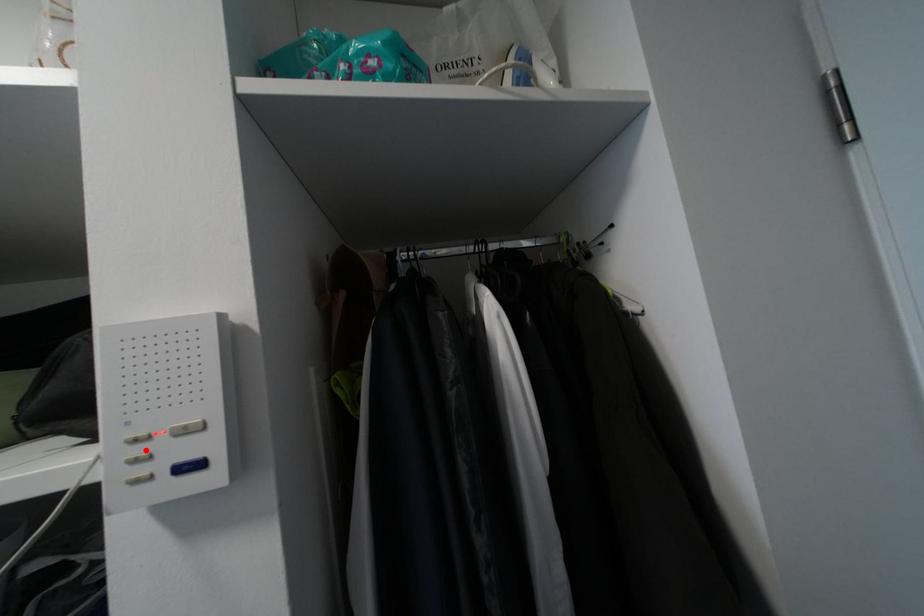
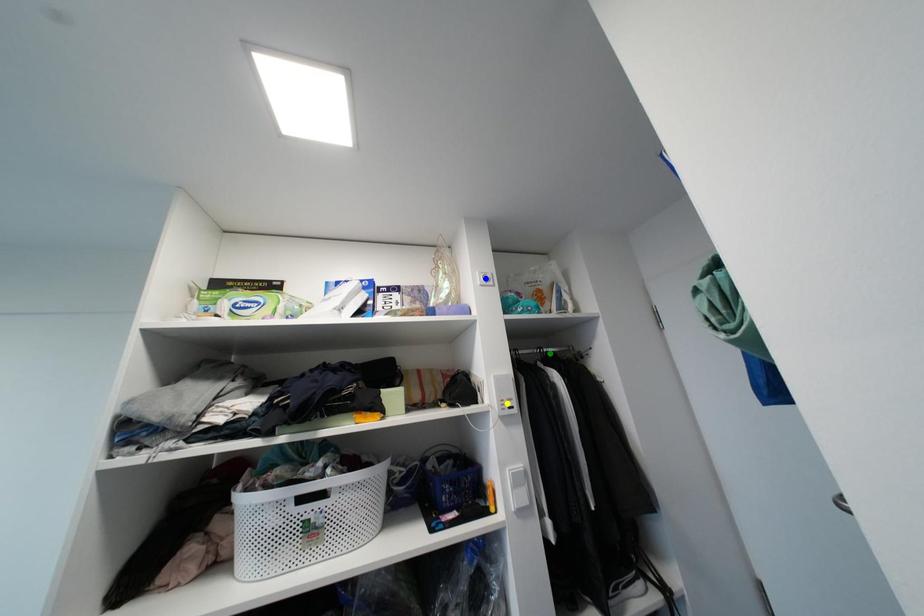
Question: I am providing you with two images of the same scene from different viewpoints. A red point is marked on the first image. You are given multiple points on the second image. In image 2, which mark is for the same physical point as the one in image 1?

Choices:
 (A) blue point
 (B) yellow point
 (C) green point

Answer: (B)